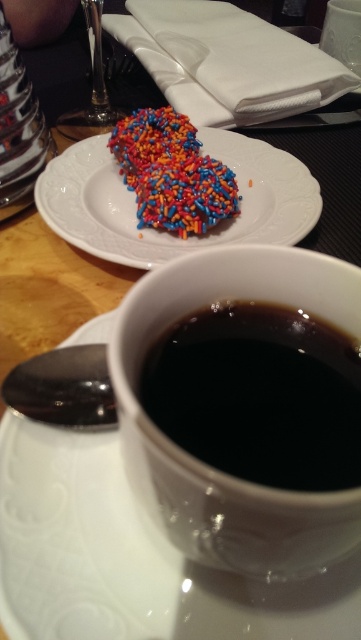
You are a customer at a cafe who wants to place a silver spoon on the table. You have to choose between placing it on the white ceramic saucer at upper center or the sprinkled cookie at upper left. Which object is shorter and thus safer to place the spoon on?

The white ceramic saucer at upper center is shorter than the sprinkled cookie at upper left, so placing the spoon on the white ceramic saucer at upper center would be safer as it is lower and more stable.

You are sitting at the table and want to reach for the pastry closest to you. Which point, point [237,394] or point [188,160], is closer to your hand?

Point [237,394] is in front of point [188,160], so the pastry at point [237,394] is closer to your hand.